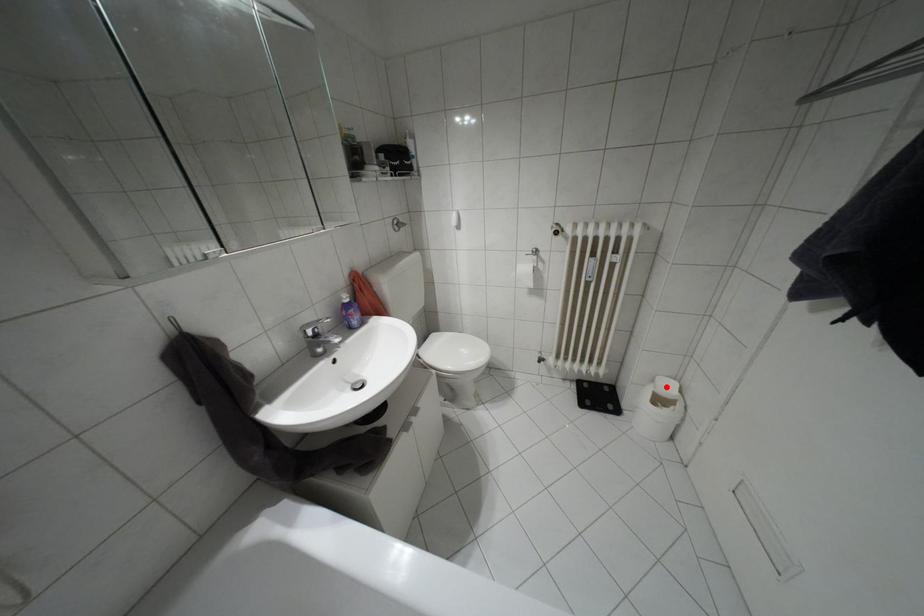
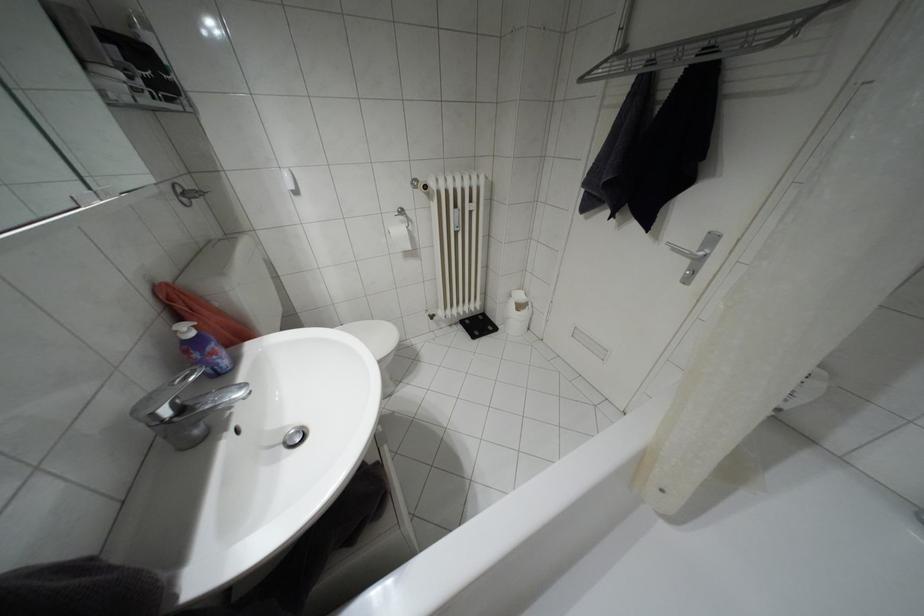
Where in the second image is the point corresponding to the highlighted location from the first image?

(518, 296)